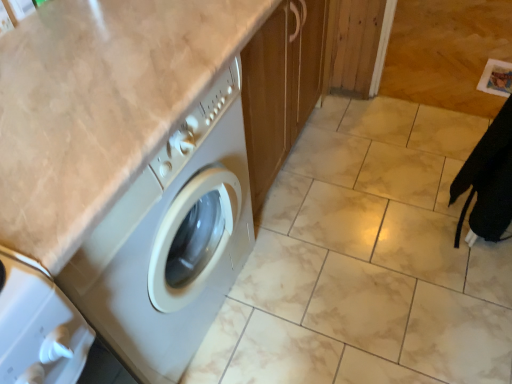
Question: Is marble tile at lower right aimed at beige marble counter top at upper left?

Choices:
 (A) yes
 (B) no

Answer: (B)

Question: Is marble tile at lower right at the left side of beige marble counter top at upper left?

Choices:
 (A) yes
 (B) no

Answer: (B)

Question: Can you confirm if marble tile at lower right is wider than beige marble counter top at upper left?

Choices:
 (A) no
 (B) yes

Answer: (B)

Question: From the image's perspective, is marble tile at lower right over beige marble counter top at upper left?

Choices:
 (A) yes
 (B) no

Answer: (A)

Question: Does marble tile at lower right have a lesser height compared to beige marble counter top at upper left?

Choices:
 (A) yes
 (B) no

Answer: (A)

Question: Is marble tile at lower right in front of beige marble counter top at upper left?

Choices:
 (A) yes
 (B) no

Answer: (B)

Question: From a real-world perspective, is beige marble counter top at upper left under marble tile at lower right?

Choices:
 (A) yes
 (B) no

Answer: (B)

Question: Does beige marble counter top at upper left turn towards marble tile at lower right?

Choices:
 (A) yes
 (B) no

Answer: (B)

Question: Is beige marble counter top at upper left thinner than marble tile at lower right?

Choices:
 (A) no
 (B) yes

Answer: (B)

Question: Considering the relative sizes of beige marble counter top at upper left and marble tile at lower right in the image provided, is beige marble counter top at upper left smaller than marble tile at lower right?

Choices:
 (A) no
 (B) yes

Answer: (A)

Question: Is beige marble counter top at upper left positioned beyond the bounds of marble tile at lower right?

Choices:
 (A) yes
 (B) no

Answer: (A)

Question: Considering the relative positions of beige marble counter top at upper left and marble tile at lower right in the image provided, is beige marble counter top at upper left to the left of marble tile at lower right from the viewer's perspective?

Choices:
 (A) no
 (B) yes

Answer: (B)

Question: Is point (82, 192) closer or farther from the camera than point (393, 79)?

Choices:
 (A) closer
 (B) farther

Answer: (A)